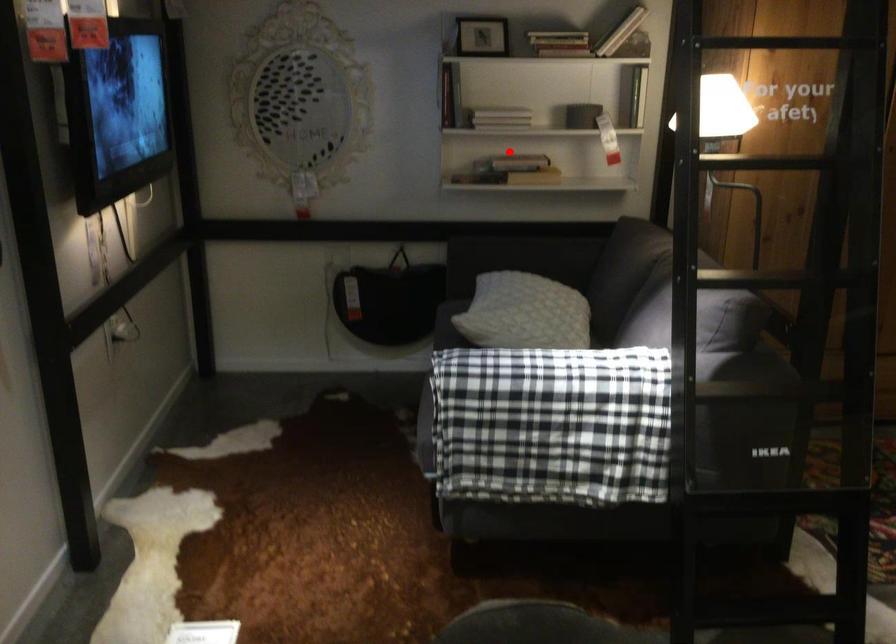
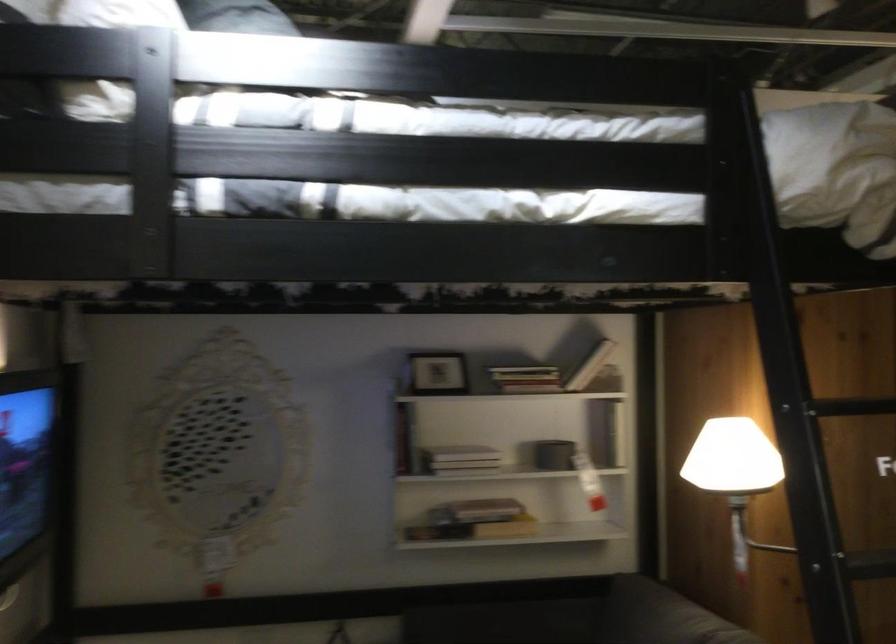
Question: A red point is marked in image1. In image2, is the corresponding 3D point closer to the camera or farther? Reply with the corresponding letter.

Choices:
 (A) The corresponding 3D point is closer.
 (B) The corresponding 3D point is farther.

Answer: (A)